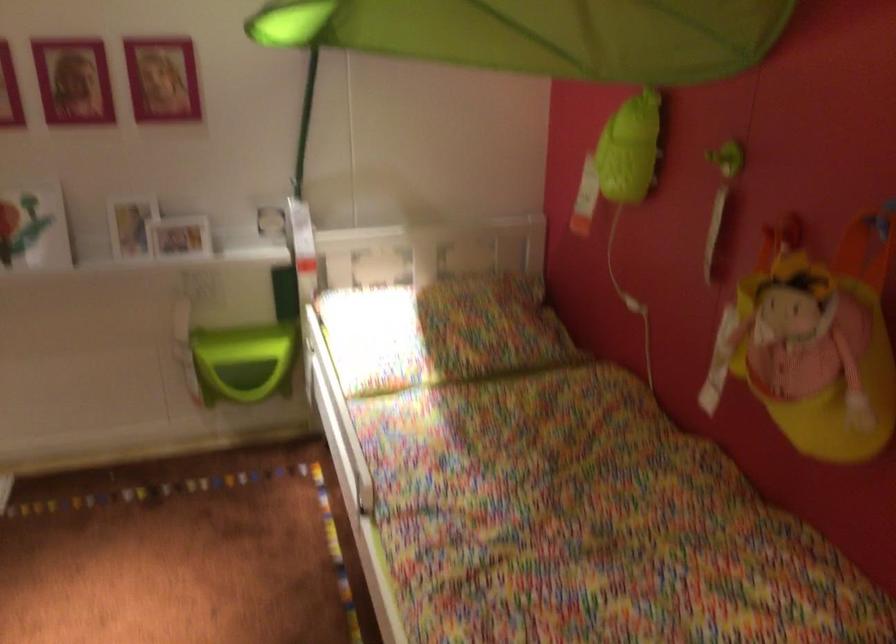
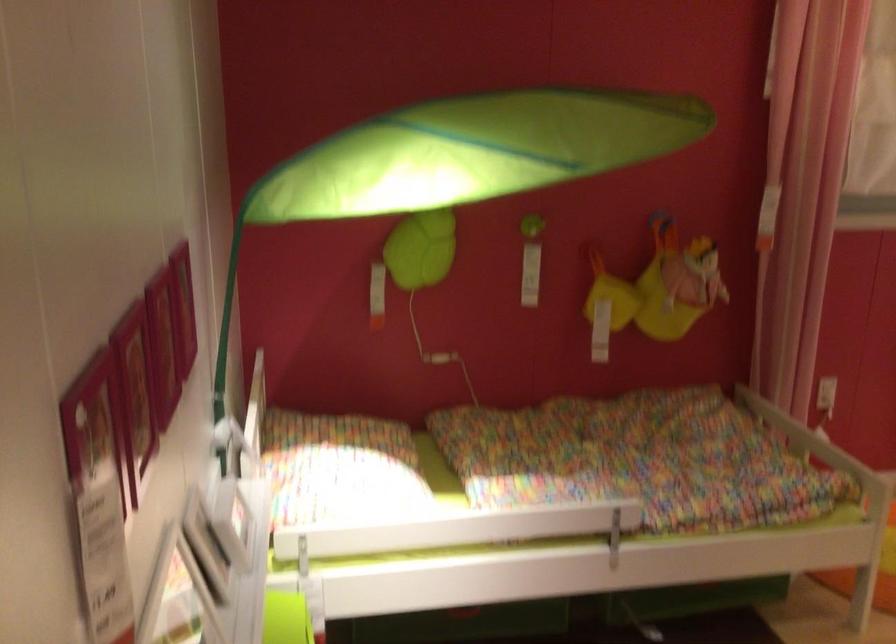
The point at (131,78) is marked in the first image. Where is the corresponding point in the second image?

(183, 308)